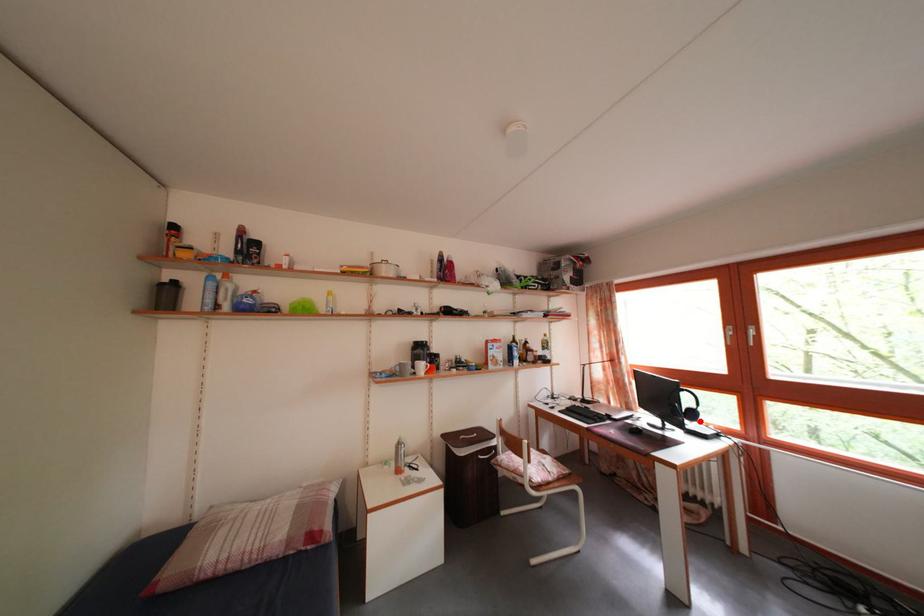
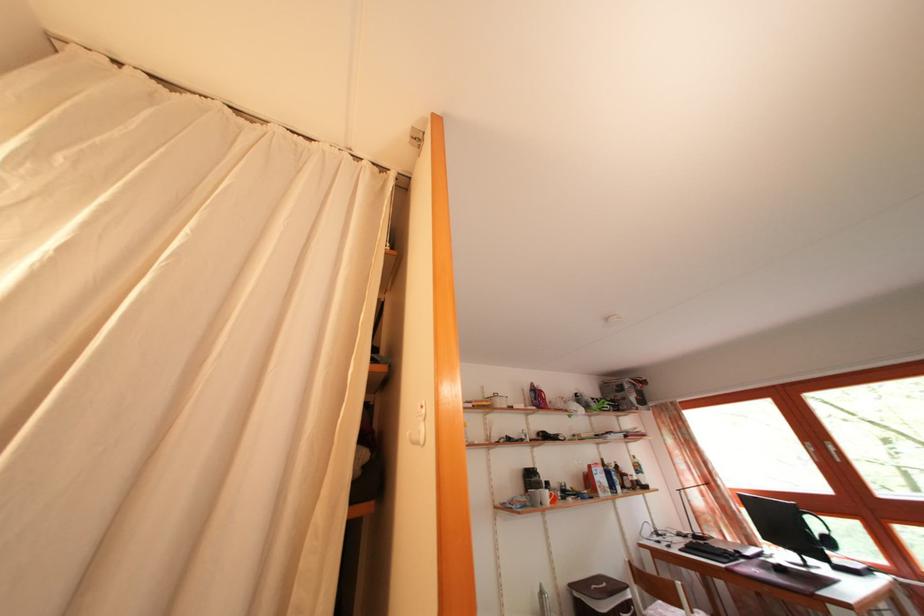
Question: I am providing you with two images of the same scene from different viewpoints. Image1 has a red point marked. In image2, the corresponding 3D location appears at what relative position? Reply with the corresponding letter.

Choices:
 (A) Closer
 (B) Farther

Answer: (A)